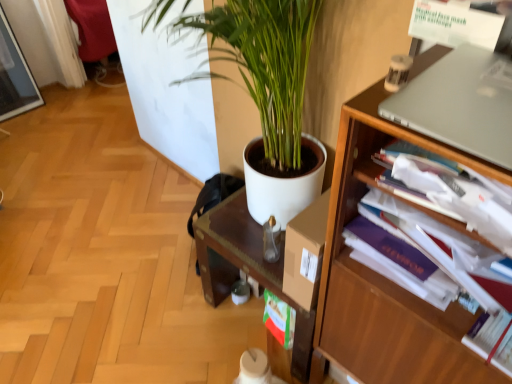
The image size is (512, 384). Identify the location of white matte plant pot at center. (248, 268).

Describe the element at coordinates (452, 193) in the screenshot. Image resolution: width=512 pixels, height=384 pixels. I see `purple paperback book at right` at that location.

Locate an element on the screen. Image resolution: width=512 pixels, height=384 pixels. wooden bookshelf at right is located at coordinates (383, 276).

Where is `silver metallic laptop at upper right`? silver metallic laptop at upper right is located at coordinates (460, 104).

Which is behind, purple paperback book at right or silver metallic laptop at upper right?

purple paperback book at right.

Is purple paperback book at right inside the boundaries of silver metallic laptop at upper right, or outside?

purple paperback book at right is located beyond the bounds of silver metallic laptop at upper right.

Considering the sizes of purple paperback book at right and silver metallic laptop at upper right in the image, is purple paperback book at right bigger or smaller than silver metallic laptop at upper right?

In the image, purple paperback book at right appears to be larger than silver metallic laptop at upper right.

Could you tell me if purple paperback book at right is facing silver metallic laptop at upper right?

No.

Between wooden bookshelf at right and silver metallic laptop at upper right, which one has less height?

With less height is silver metallic laptop at upper right.

Is wooden bookshelf at right positioned before silver metallic laptop at upper right?

Yes, wooden bookshelf at right is closer to the camera.

From the image's perspective, does wooden bookshelf at right appear higher than silver metallic laptop at upper right?

No, from the image's perspective, wooden bookshelf at right is not over silver metallic laptop at upper right.

Is wooden bookshelf at right wider or thinner than silver metallic laptop at upper right?

Clearly, wooden bookshelf at right has more width compared to silver metallic laptop at upper right.

You are a GUI agent. You are given a task and a screenshot of the screen. Output one action in this format:
    pyautogui.click(x=<x>, y=<y>)
    Task: Click on the computer desk that appears behind the purple paperback book at right
    Image resolution: width=512 pixels, height=384 pixels.
    Given the screenshot: What is the action you would take?
    pyautogui.click(x=248, y=268)

Is purple paperback book at right closer to the viewer compared to white matte plant pot at center?

Yes, purple paperback book at right is closer to the viewer.

Who is shorter, purple paperback book at right or white matte plant pot at center?

purple paperback book at right.

How distant is purple paperback book at right from white matte plant pot at center?

26.63 inches.

Does silver metallic laptop at upper right have a lesser height compared to white matte plant pot at center?

Yes, silver metallic laptop at upper right is shorter than white matte plant pot at center.

Which object is further away from the camera taking this photo, silver metallic laptop at upper right or white matte plant pot at center?

Positioned behind is white matte plant pot at center.

From the image's perspective, is silver metallic laptop at upper right on top of white matte plant pot at center?

Yes, from the image's perspective, silver metallic laptop at upper right is above white matte plant pot at center.

Who is bigger, purple paperback book at right or wooden bookshelf at right?

wooden bookshelf at right.

This screenshot has height=384, width=512. Identify the location of magazine above the wooden bookshelf at right (from a real-world perspective). (452, 193).

Looking at this image, choose the correct answer: Is purple paperback book at right inside wooden bookshelf at right or outside it?

The correct answer is: inside.

Is silver metallic laptop at upper right smaller than purple paperback book at right?

Yes, silver metallic laptop at upper right is smaller than purple paperback book at right.

From the image's perspective, is silver metallic laptop at upper right positioned above or below purple paperback book at right?

silver metallic laptop at upper right is above purple paperback book at right.

I want to click on magazine that appears behind the silver metallic laptop at upper right, so click(452, 193).

Considering their positions, is silver metallic laptop at upper right located in front of or behind purple paperback book at right?

Visually, silver metallic laptop at upper right is located in front of purple paperback book at right.

Is point (206, 274) farther from camera compared to point (501, 219)?

Yes, it is behind point (501, 219).

From the image's perspective, which is below, white matte plant pot at center or purple paperback book at right?

white matte plant pot at center is shown below in the image.

Which of these two, white matte plant pot at center or purple paperback book at right, is thinner?

Thinner between the two is purple paperback book at right.

Is white matte plant pot at center touching purple paperback book at right?

white matte plant pot at center is not next to purple paperback book at right, and they're not touching.

Find the location of a particular element. computer in front of the purple paperback book at right is located at coordinates (460, 104).

The image size is (512, 384). I want to click on computer above the wooden bookshelf at right (from the image's perspective), so click(460, 104).

Considering their positions, is wooden bookshelf at right positioned further to purple paperback book at right than silver metallic laptop at upper right?

Answer: wooden bookshelf at right lies further to purple paperback book at right than the other object.

When comparing their distances from white matte plant pot at center, does purple paperback book at right or wooden bookshelf at right seem closer?

wooden bookshelf at right.

Looking at the image, which one is located closer to wooden bookshelf at right, silver metallic laptop at upper right or purple paperback book at right?

Based on the image, purple paperback book at right appears to be nearer to wooden bookshelf at right.

Estimate the real-world distances between objects in this image. Which object is further from purple paperback book at right, white matte plant pot at center or wooden bookshelf at right?

The object further to purple paperback book at right is white matte plant pot at center.

Which object lies further to the anchor point white matte plant pot at center, silver metallic laptop at upper right or wooden bookshelf at right?

silver metallic laptop at upper right.

Looking at the image, which one is located closer to wooden bookshelf at right, purple paperback book at right or white matte plant pot at center?

purple paperback book at right lies closer to wooden bookshelf at right than the other object.

Estimate the real-world distances between objects in this image. Which object is closer to purple paperback book at right, wooden bookshelf at right or white matte plant pot at center?

Among the two, wooden bookshelf at right is located nearer to purple paperback book at right.

Considering their positions, is silver metallic laptop at upper right positioned further to purple paperback book at right than white matte plant pot at center?

white matte plant pot at center.

Locate an element on the screen. The image size is (512, 384). magazine between silver metallic laptop at upper right and white matte plant pot at center along the z-axis is located at coordinates 452,193.

Find the location of `computer between wooden bookshelf at right and white matte plant pot at center in the front-back direction`. computer between wooden bookshelf at right and white matte plant pot at center in the front-back direction is located at coordinates (460, 104).

At what (x,y) coordinates should I click in order to perform the action: click on magazine between silver metallic laptop at upper right and wooden bookshelf at right in the vertical direction. Please return your answer as a coordinate pair (x, y). Looking at the image, I should click on (452, 193).

This screenshot has height=384, width=512. In order to click on magazine between wooden bookshelf at right and white matte plant pot at center in the front-back direction in this screenshot , I will do `click(452, 193)`.